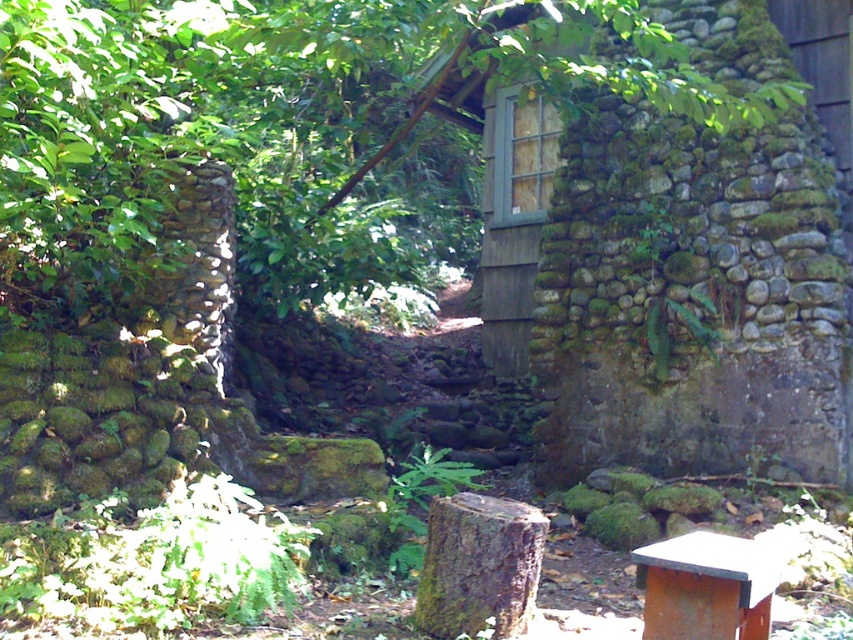
You are a gardener who needs to place a new 1.2 meter wide flower pot between the mossy bark stump at center and the rusty metal beehive at lower right. Can the flower pot fit between them?

The mossy bark stump at center is wider than the rusty metal beehive at lower right. However, the exact distance between them isn t provided in the scene description. Without knowing the space between the two objects, it s impossible to determine if the 1.2 meter wide flower pot will fit.

You are standing in front of the stone structure and want to place a new beehive. The current rusty metal beehive at lower right is where you want to replace it. Where should the new beehive be placed relative to the mossy bark stump at center?

The new beehive should be placed to the right of the mossy bark stump at center since the rusty metal beehive at lower right is located to the right of it.

You are standing in front of the stone structure and want to determine the relative positions of two points marked on it. Which point is closer to you, point [424,589] or point [651,636]?

Point [424,589] is closer to you because it is further to the viewer than point [651,636].